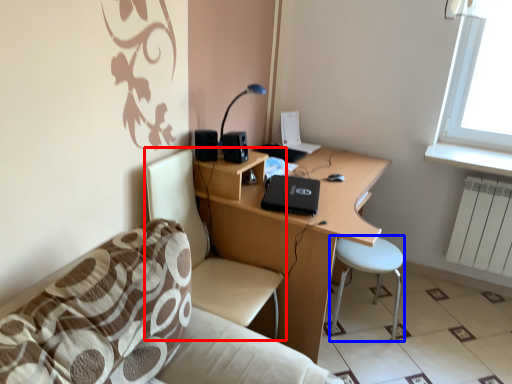
Question: Which object is closer to the camera taking this photo, chair (highlighted by a red box) or bar stool (highlighted by a blue box)?

Choices:
 (A) chair
 (B) bar stool

Answer: (A)